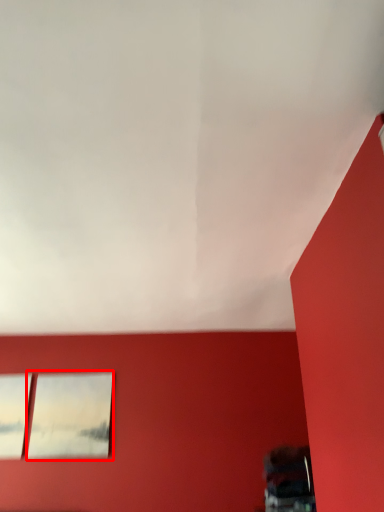
Question: From the image's perspective, considering the relative positions of picture frame (annotated by the red box) and window in the image provided, where is picture frame (annotated by the red box) located with respect to the staircase?

Choices:
 (A) below
 (B) above

Answer: (A)